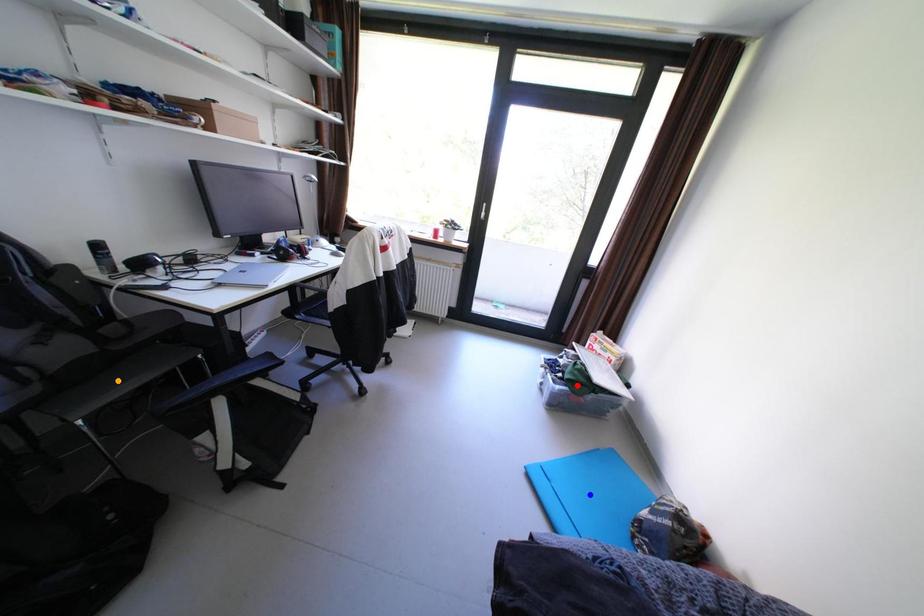
Looking at this image, order these from nearest to farthest:
1. orange point
2. blue point
3. red point

orange point, blue point, red point